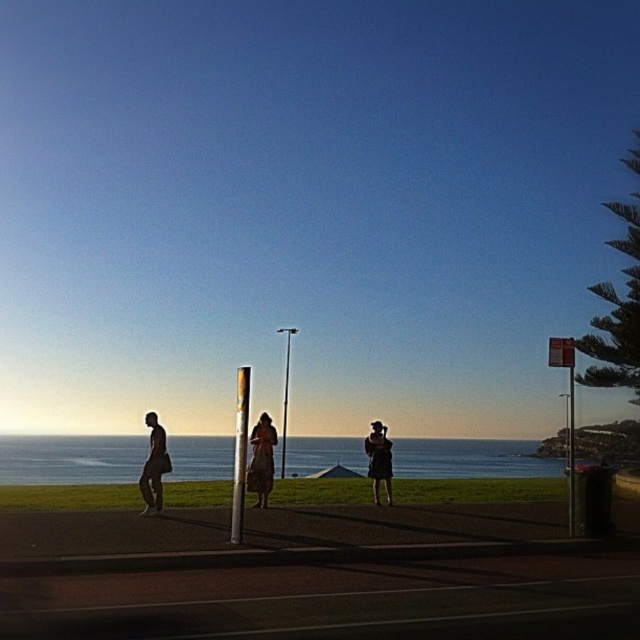
Question: Does blue water at lower center have a smaller size compared to dark blue dress at center?

Choices:
 (A) yes
 (B) no

Answer: (B)

Question: Which object is farther from the camera taking this photo?

Choices:
 (A) metallic pole at right
 (B) dark gray fabric shirt at left
 (C) metallic pole at center

Answer: (C)

Question: Which point is closer to the camera taking this photo?

Choices:
 (A) (284, 472)
 (B) (140, 480)
 (C) (262, 438)

Answer: (B)

Question: Which object is the farthest from the blue water at lower center?

Choices:
 (A) metallic pole at center
 (B) dark gray fabric shirt at left

Answer: (B)

Question: Is blue water at lower center above brown textured dress at center?

Choices:
 (A) no
 (B) yes

Answer: (A)

Question: Can you confirm if gold metallic pole at center is positioned to the right of metallic pole at center?

Choices:
 (A) yes
 (B) no

Answer: (B)